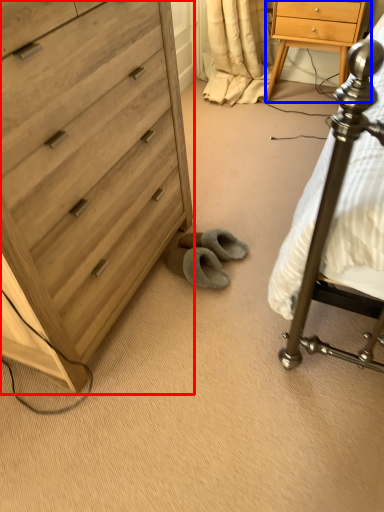
Question: Which object is further to the camera taking this photo, chest of drawers (highlighted by a red box) or nightstand (highlighted by a blue box)?

Choices:
 (A) chest of drawers
 (B) nightstand

Answer: (B)